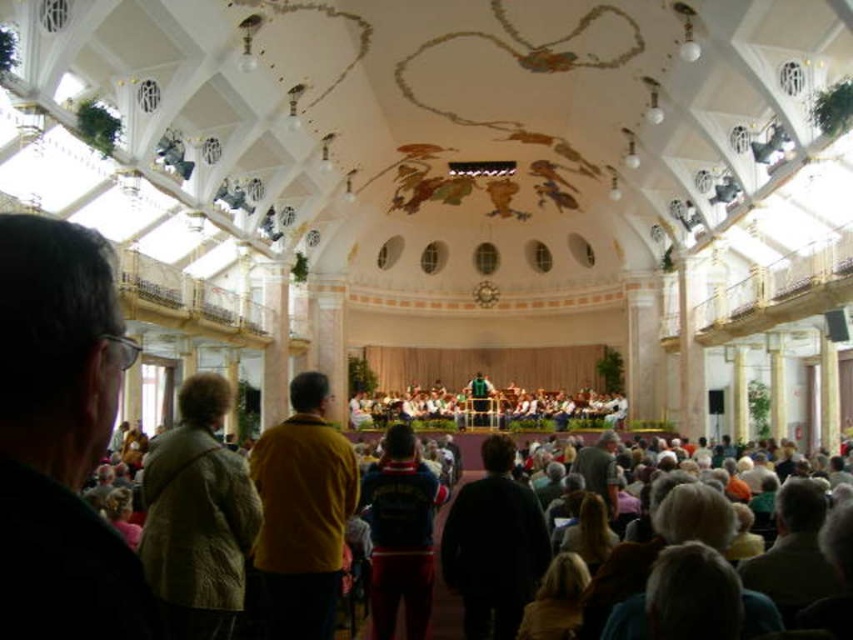
Does light brown textured jacket at center appear under mustard yellow sweater at center?

Yes.

Does light brown textured jacket at center have a lesser height compared to mustard yellow sweater at center?

Yes, light brown textured jacket at center is shorter than mustard yellow sweater at center.

You are a GUI agent. You are given a task and a screenshot of the screen. Output one action in this format:
    pyautogui.click(x=<x>, y=<y>)
    Task: Click on the light brown textured jacket at center
    This screenshot has height=640, width=853.
    Given the screenshot: What is the action you would take?
    pyautogui.click(x=196, y=515)

Locate an element on the screen. The height and width of the screenshot is (640, 853). light brown textured jacket at center is located at coordinates (196, 515).